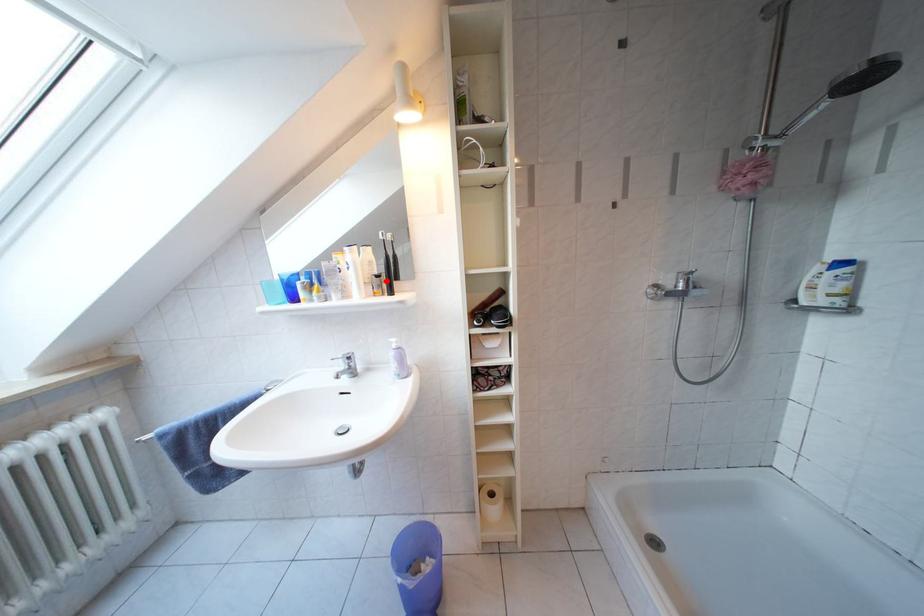
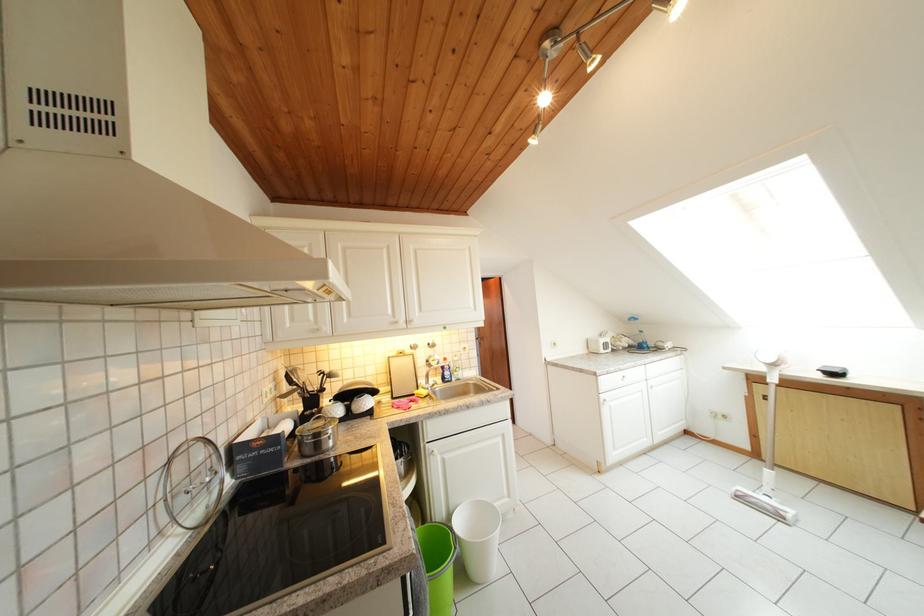
Question: I am providing you with two images of the same scene from different viewpoints. A red point is marked on the first image. At the location where the point appears in image 1, is it still visible in image 2?

Choices:
 (A) Yes
 (B) No

Answer: (B)